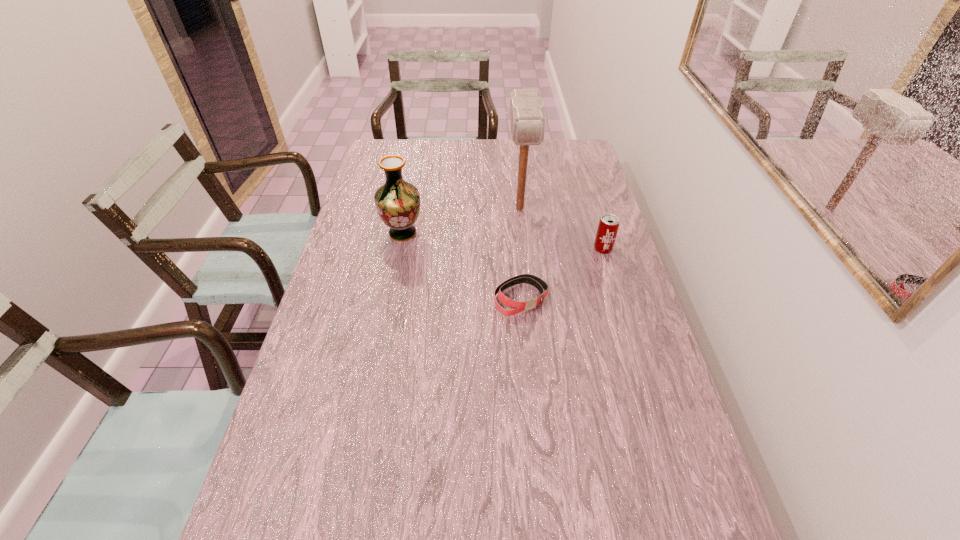
Find the location of `vacant area between the beer can and the mallet`. vacant area between the beer can and the mallet is located at coordinates (562, 228).

Locate an element on the screen. empty space that is in between the tallest object and the dog collar is located at coordinates (520, 253).

At what (x,y) coordinates should I click in order to perform the action: click on free space between the vase and the nearest object. Please return your answer as a coordinate pair (x, y). Looking at the image, I should click on (462, 266).

Locate which object is the closest to the tallest object. Please provide its 2D coordinates. Your answer should be formatted as a tuple, i.e. [(x, y)], where the tuple contains the x and y coordinates of a point satisfying the conditions above.

[(608, 226)]

Locate an element on the screen. This screenshot has height=540, width=960. object that stands as the third closest to the shortest object is located at coordinates (397, 202).

Locate an element on the screen. free spot that satisfies the following two spatial constraints: 1. on the front side of the vase; 2. on the right side of the rightmost object is located at coordinates (x=399, y=249).

You are a GUI agent. You are given a task and a screenshot of the screen. Output one action in this format:
    pyautogui.click(x=<x>, y=<y>)
    Task: Click on the vacant region that satisfies the following two spatial constraints: 1. on the striking face of the third tallest object; 2. on the left side of the mallet
    The width and height of the screenshot is (960, 540).
    Given the screenshot: What is the action you would take?
    pyautogui.click(x=524, y=249)